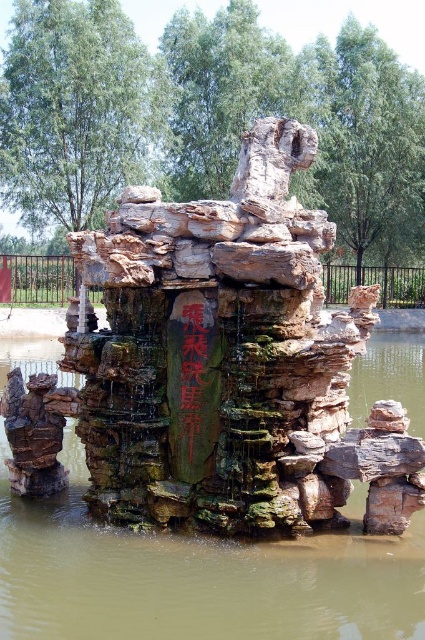
Question: Which point is closer to the camera?

Choices:
 (A) (337, 540)
 (B) (27, 442)
 (C) (184, 369)

Answer: (A)

Question: Estimate the real-world distances between objects in this image. Which object is farther from the rusty stone rock at left?

Choices:
 (A) green mossy rock at center
 (B) black stone writing at center

Answer: (A)

Question: Which object appears closest to the camera in this image?

Choices:
 (A) rusty stone rock at left
 (B) black stone writing at center

Answer: (B)

Question: Is green mossy rock at center bigger than rusty stone rock at left?

Choices:
 (A) no
 (B) yes

Answer: (B)

Question: Does green mossy rock at center appear on the right side of rusty stone rock at left?

Choices:
 (A) no
 (B) yes

Answer: (B)

Question: Does green mossy rock at center appear under black stone writing at center?

Choices:
 (A) yes
 (B) no

Answer: (A)